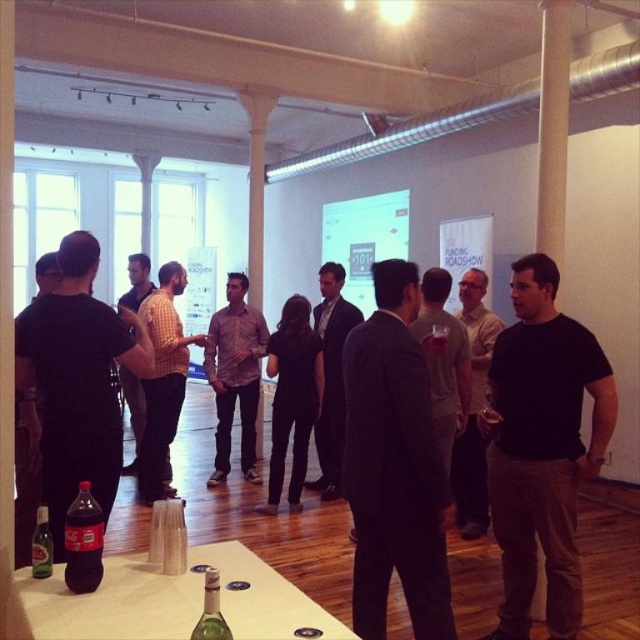
You are organizing a small event and need to place a decorative item on the table. The checkered shirt at center and the green glass bottle at lower left are currently on the table. Which object occupies more horizontal space on the table?

The checkered shirt at center might be wider than green glass bottle at lower left, so it could occupy more horizontal space on the table.

You are at the table and want to reach the checkered shirt at center. Is the black matte shirt at center blocking your direct path to it?

The black matte shirt at center is in front of the checkered shirt at center, so it is blocking the direct path to the checkered shirt at center.

You are a guest at the gathering and want to place a small decorative item between the checkered shirt at center and the green glass bottle at lower left on the table. Considering their heights, which object should you place the item closer to to ensure stability?

You should place the item closer to the checkered shirt at center because it is much taller than the green glass bottle at lower left, providing a more stable base.